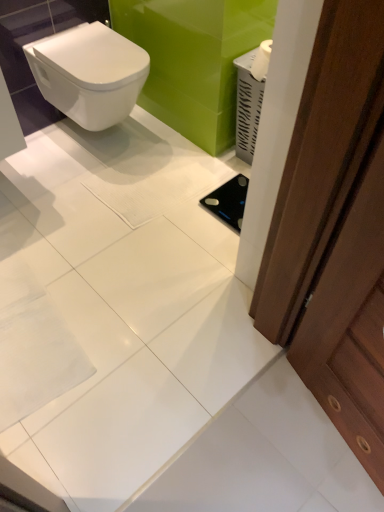
What do you see at coordinates (89, 74) in the screenshot?
I see `white glossy toilet at upper left` at bounding box center [89, 74].

In order to face white glossy toilet at upper left, should I rotate leftwards or rightwards?

Turn left approximately 12.297 degrees to face it.

This screenshot has height=512, width=384. In order to click on white glossy toilet at upper left in this screenshot , I will do `click(89, 74)`.

What is the approximate height of brown wooden door at right?

The height of brown wooden door at right is 26.13 inches.

Measure the distance between brown wooden door at right and camera.

brown wooden door at right and camera are 25.17 inches apart.

Image resolution: width=384 pixels, height=512 pixels. What are the coordinates of `brown wooden door at right` in the screenshot? It's located at 321,158.

What do you see at coordinates (321, 158) in the screenshot?
I see `brown wooden door at right` at bounding box center [321, 158].

In order to click on white glossy toilet at upper left in this screenshot , I will do `click(89, 74)`.

Considering the positions of objects white glossy toilet at upper left and brown wooden door at right in the image provided, who is more to the left, white glossy toilet at upper left or brown wooden door at right?

Positioned to the left is white glossy toilet at upper left.

Which is behind, white glossy toilet at upper left or brown wooden door at right?

white glossy toilet at upper left is behind.

Between point (119, 35) and point (301, 281), which one is positioned behind?

The point (119, 35) is farther.

From the image's perspective, is white glossy toilet at upper left located above brown wooden door at right?

Correct, white glossy toilet at upper left appears higher than brown wooden door at right in the image.

From a real-world perspective, is white glossy toilet at upper left above or below brown wooden door at right?

white glossy toilet at upper left is situated lower than brown wooden door at right in the real world.

Considering the sizes of white glossy toilet at upper left and brown wooden door at right in the image, is white glossy toilet at upper left wider or thinner than brown wooden door at right?

In the image, white glossy toilet at upper left appears to be wider than brown wooden door at right.

Does white glossy toilet at upper left have a lesser height compared to brown wooden door at right?

Yes, white glossy toilet at upper left is shorter than brown wooden door at right.

Looking at this image, which of these two, white glossy toilet at upper left or brown wooden door at right, is smaller?

Smaller between the two is brown wooden door at right.

Is white glossy toilet at upper left inside or outside of brown wooden door at right?

white glossy toilet at upper left lies outside brown wooden door at right.

Is white glossy toilet at upper left beside brown wooden door at right?

white glossy toilet at upper left and brown wooden door at right are clearly separated.

Is white glossy toilet at upper left oriented towards brown wooden door at right?

Yes, white glossy toilet at upper left is turned towards brown wooden door at right.

Can you tell me how much white glossy toilet at upper left and brown wooden door at right differ in facing direction?

The facing directions of white glossy toilet at upper left and brown wooden door at right are 92.8 degrees apart.

How far apart are white glossy toilet at upper left and brown wooden door at right?

1.20 meters.

The width and height of the screenshot is (384, 512). I want to click on toilet lying above the brown wooden door at right (from the image's perspective), so click(x=89, y=74).

Considering the relative positions of brown wooden door at right and white glossy toilet at upper left in the image provided, is brown wooden door at right to the right of white glossy toilet at upper left from the viewer's perspective?

Yes, brown wooden door at right is to the right of white glossy toilet at upper left.

In the image, is brown wooden door at right positioned in front of or behind white glossy toilet at upper left?

brown wooden door at right is in front of white glossy toilet at upper left.

Is point (376, 2) positioned in front of point (133, 48)?

Yes.

From the picture: From the image's perspective, is brown wooden door at right located above white glossy toilet at upper left?

No, from the image's perspective, brown wooden door at right is not above white glossy toilet at upper left.

From a real-world perspective, between brown wooden door at right and white glossy toilet at upper left, who is vertically lower?

white glossy toilet at upper left is physically lower.

Considering the sizes of objects brown wooden door at right and white glossy toilet at upper left in the image provided, who is thinner, brown wooden door at right or white glossy toilet at upper left?

With smaller width is brown wooden door at right.

Does brown wooden door at right have a greater height compared to white glossy toilet at upper left?

Correct, brown wooden door at right is much taller as white glossy toilet at upper left.

Can you confirm if brown wooden door at right is smaller than white glossy toilet at upper left?

Indeed, brown wooden door at right has a smaller size compared to white glossy toilet at upper left.

Would you say brown wooden door at right is inside or outside white glossy toilet at upper left?

The correct answer is: outside.

Would you consider brown wooden door at right to be distant from white glossy toilet at upper left?

Yes, brown wooden door at right is far from white glossy toilet at upper left.

Is brown wooden door at right positioned with its back to white glossy toilet at upper left?

No, brown wooden door at right is not facing the opposite direction of white glossy toilet at upper left.

What's the angular difference between brown wooden door at right and white glossy toilet at upper left's facing directions?

The facing directions of brown wooden door at right and white glossy toilet at upper left are 92.8 degrees apart.

In order to click on screen door located below the white glossy toilet at upper left (from the image's perspective) in this screenshot , I will do `click(321, 158)`.

You are a GUI agent. You are given a task and a screenshot of the screen. Output one action in this format:
    pyautogui.click(x=<x>, y=<y>)
    Task: Click on the screen door above the white glossy toilet at upper left (from a real-world perspective)
    The width and height of the screenshot is (384, 512).
    Given the screenshot: What is the action you would take?
    pyautogui.click(x=321, y=158)

You are a GUI agent. You are given a task and a screenshot of the screen. Output one action in this format:
    pyautogui.click(x=<x>, y=<y>)
    Task: Click on the toilet that is under the brown wooden door at right (from a real-world perspective)
    This screenshot has width=384, height=512.
    Given the screenshot: What is the action you would take?
    pyautogui.click(x=89, y=74)